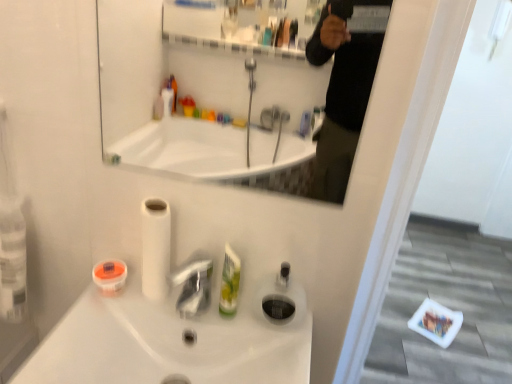
Question: Is white glossy sink at center facing away from green plastic mouthwash at center, which is counted as the second mouthwash, starting from the left?

Choices:
 (A) no
 (B) yes

Answer: (A)

Question: From a real-world perspective, is white glossy sink at center physically below green plastic mouthwash at center, the 1th mouthwash in the right-to-left sequence?

Choices:
 (A) no
 (B) yes

Answer: (B)

Question: Considering the relative positions of white glossy sink at center and green plastic mouthwash at center, which is counted as the second mouthwash, starting from the left, in the image provided, is white glossy sink at center to the right of green plastic mouthwash at center, which is counted as the second mouthwash, starting from the left, from the viewer's perspective?

Choices:
 (A) yes
 (B) no

Answer: (B)

Question: Would you say white glossy sink at center contains green plastic mouthwash at center, which is counted as the second mouthwash, starting from the left?

Choices:
 (A) no
 (B) yes

Answer: (A)

Question: Would you consider white glossy sink at center to be distant from green plastic mouthwash at center, which is counted as the second mouthwash, starting from the left?

Choices:
 (A) yes
 (B) no

Answer: (B)

Question: From the image's perspective, is white glossy sink at center on green plastic mouthwash at center, the 1th mouthwash in the right-to-left sequence?

Choices:
 (A) yes
 (B) no

Answer: (B)

Question: Is the position of white matte toilet paper at center more distant than that of white glossy sink at center?

Choices:
 (A) no
 (B) yes

Answer: (B)

Question: From the image's perspective, is white matte toilet paper at center beneath white glossy sink at center?

Choices:
 (A) yes
 (B) no

Answer: (B)

Question: Is white matte toilet paper at center at the right side of white glossy sink at center?

Choices:
 (A) yes
 (B) no

Answer: (B)

Question: Does white matte toilet paper at center have a greater height compared to white glossy sink at center?

Choices:
 (A) yes
 (B) no

Answer: (A)

Question: Can white glossy sink at center be found inside white matte toilet paper at center?

Choices:
 (A) yes
 (B) no

Answer: (B)

Question: From a real-world perspective, is white matte toilet paper at center on white glossy sink at center?

Choices:
 (A) no
 (B) yes

Answer: (B)

Question: Is white glossy sink at center outside white glossy mirror at upper center?

Choices:
 (A) yes
 (B) no

Answer: (A)